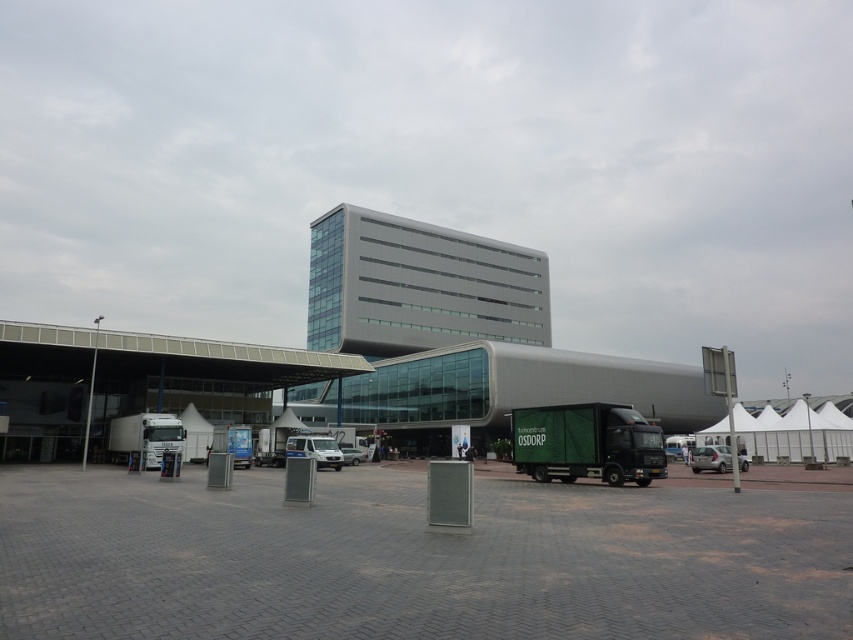
You are standing at the entrance of the complex and want to locate two specific points marked in the image. Which of the two points, point 1 at coordinates (x=611, y=433) or point 2 at (x=357, y=456), is closer to you?

Point 1 at coordinates (x=611, y=433) is closer to the viewer than point 2 at (x=357, y=456).

You are standing at the entrance of the complex and want to find the green matte truck at lower right. Based on the coordinates provided, in which direction should you walk to locate it?

The green matte truck at lower right is located at coordinates point (585, 444). Since the coordinate system typically places the origin at the bottom left corner, the truck is positioned towards the lower right area of the image. Therefore, you should walk towards the lower right direction from the entrance to locate it.

You are a delivery person who needs to exit the parking lot. You see the green matte truck at lower right and the silver metallic sedan at lower right. Which vehicle is blocking your path?

The green matte truck at lower right is blocking your path because it is in front of the silver metallic sedan at lower right.